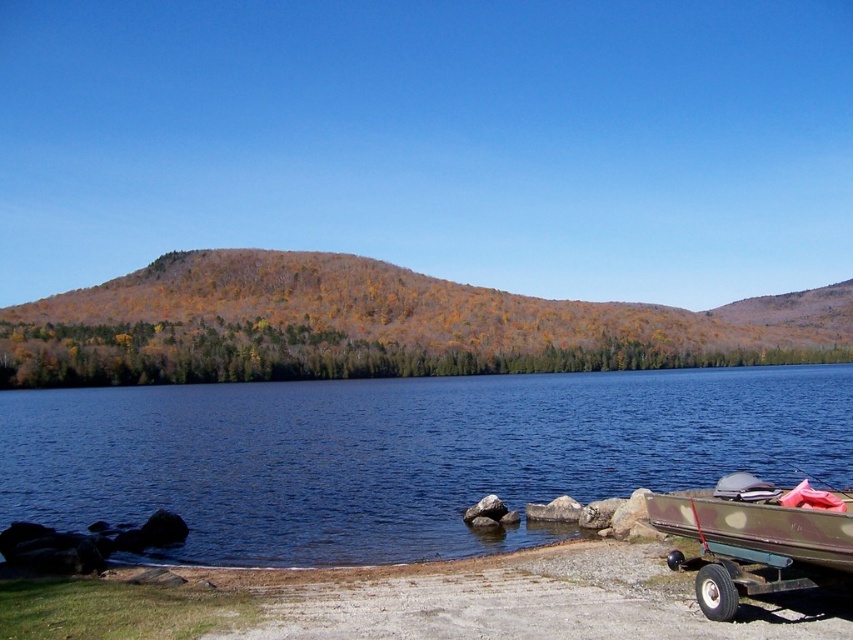
You are planning to launch a small kayak from the lakeside area shown in the image. The kayak is 2 meters long. The blue water at lower center is where you intend to paddle. Considering the size of the camouflage fabric boat at lower right, which is parked on a trailer, do you think there is enough space on the trailer to fit your kayak alongside it?

The blue water at lower center is larger in size than the camouflage fabric boat at lower right. Since the camouflage fabric boat at lower right is smaller than the water area, but the trailer space available isn not directly mentioned, it is uncertain if the kayak will fit. However, if the trailer can accommodate the existing boat, there might be room for the kayak as well, depending on the trailer dimensions.

You are standing at the lakeside and want to reach the point marked as point (368,534). If your maximum walking distance is 20 meters, can you reach it without swimming?

The point (368,534) is 20.89 meters away from the viewer. Since your maximum walking distance is 20 meters, you cannot reach it without swimming.